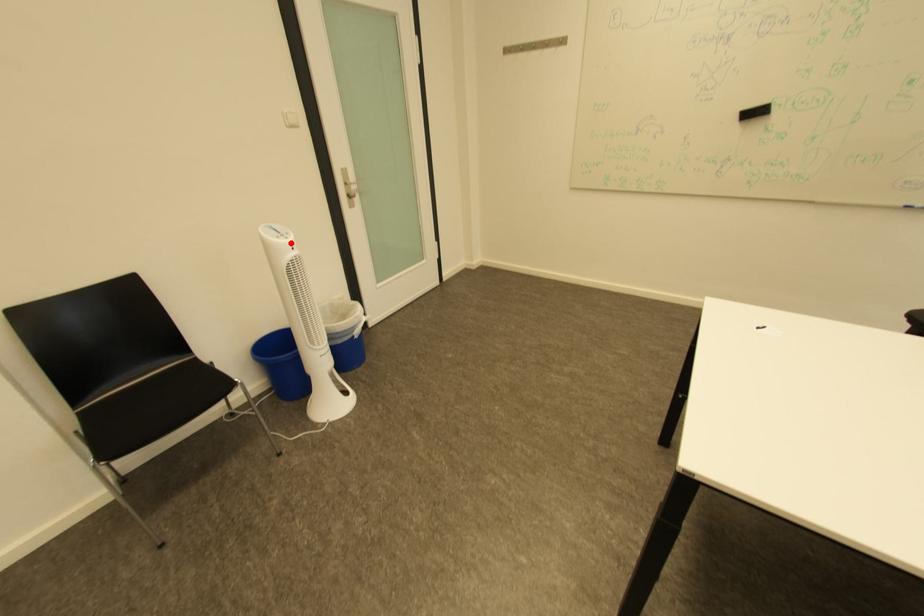
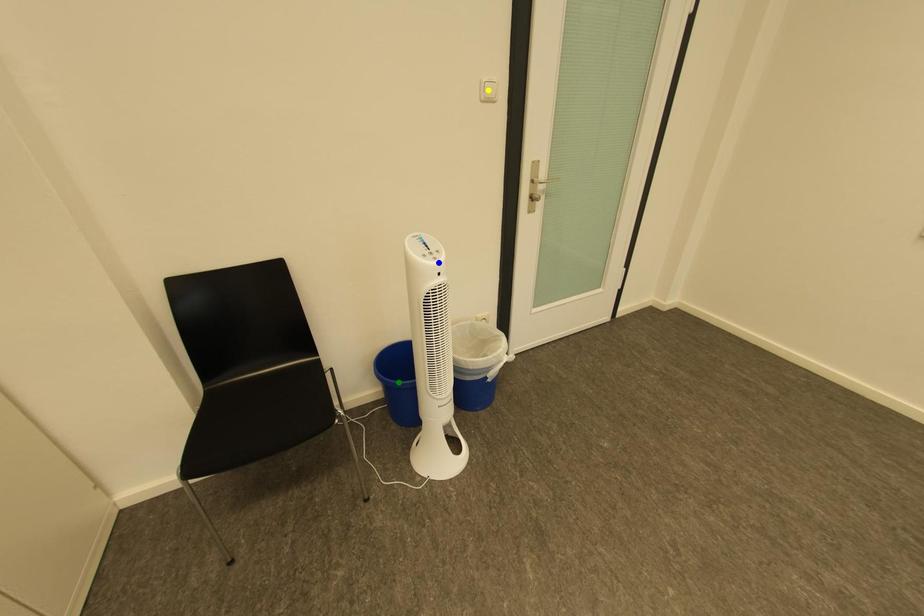
Question: I am providing you with two images of the same scene from different viewpoints. A red point is marked on the first image. You are given multiple points on the second image. Which point in image 2 is actually the same real-world point as the red point in image 1?

Choices:
 (A) yellow point
 (B) blue point
 (C) green point

Answer: (B)